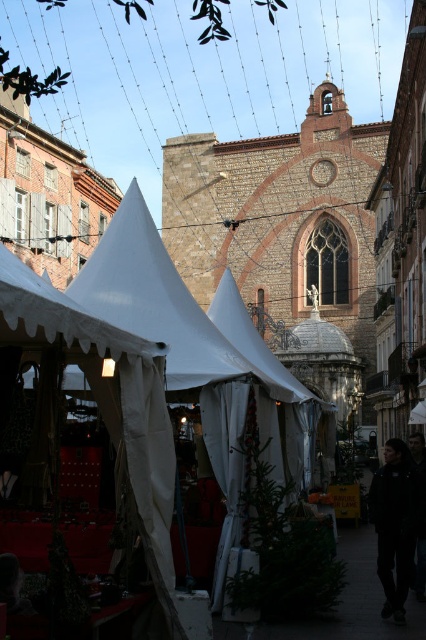
Does white canvas tent at left appear under white fabric tent at left?

Yes, white canvas tent at left is below white fabric tent at left.

Which is behind, point (172, 497) or point (94, 266)?

The point (94, 266) is behind.

Describe the element at coordinates (109, 404) in the screenshot. The image size is (426, 640). I see `white canvas tent at left` at that location.

The height and width of the screenshot is (640, 426). I want to click on white canvas tent at left, so click(x=109, y=404).

Which is in front, point (158, 253) or point (403, 564)?

Point (403, 564) is more forward.

Is the position of white fabric tent at left more distant than that of black fabric at lower right?

No, white fabric tent at left is closer to the viewer.

Between point (103, 237) and point (399, 483), which one is positioned in front?

Point (399, 483)

Where is `white fabric tent at left`? The height and width of the screenshot is (640, 426). white fabric tent at left is located at coordinates (155, 301).

Is white canvas tent at left below black fabric at lower right?

Actually, white canvas tent at left is above black fabric at lower right.

Between white canvas tent at left and black fabric at lower right, which one has less height?

black fabric at lower right

Which is in front, point (163, 552) or point (397, 452)?

Positioned in front is point (163, 552).

Identify the location of white canvas tent at left. (109, 404).